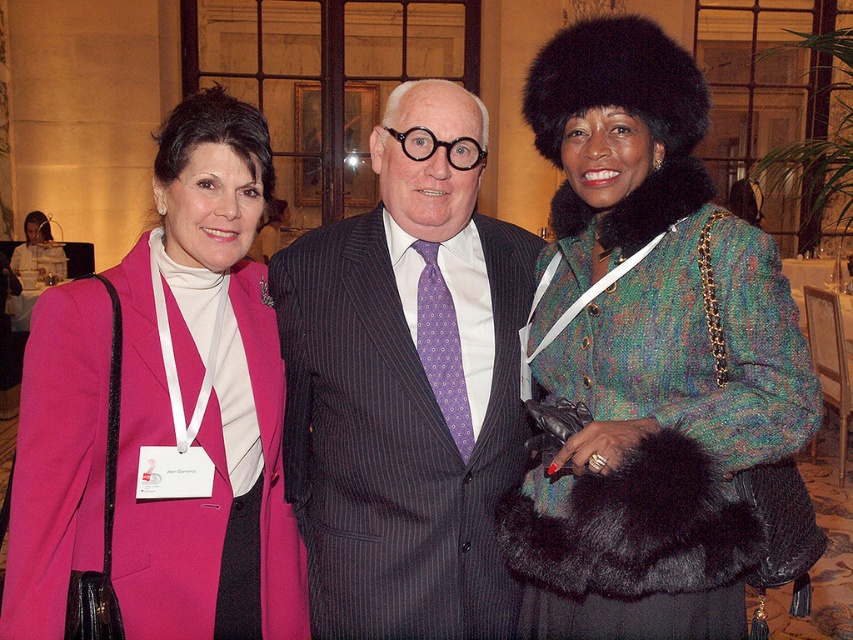
Question: Based on their relative distances, which object is farther from the purple pinstriped suit at center?

Choices:
 (A) matte pink coat at center
 (B) multicolored tweed coat at center

Answer: (B)

Question: Can you confirm if multicolored tweed coat at center is bigger than matte pink coat at center?

Choices:
 (A) yes
 (B) no

Answer: (A)

Question: Considering the real-world distances, which object is farthest from the purple pinstriped suit at center?

Choices:
 (A) multicolored tweed coat at center
 (B) matte pink coat at center

Answer: (A)

Question: Which point appears farthest from the camera in this image?

Choices:
 (A) click(x=494, y=605)
 (B) click(x=152, y=588)

Answer: (A)

Question: Is multicolored tweed coat at center above matte pink coat at center?

Choices:
 (A) no
 (B) yes

Answer: (B)

Question: Is the position of multicolored tweed coat at center more distant than that of matte pink coat at center?

Choices:
 (A) yes
 (B) no

Answer: (B)